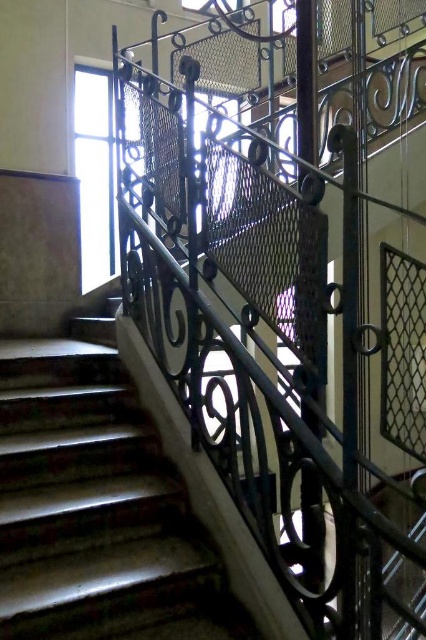
Between point (236, 241) and point (143, 486), which one is positioned behind?

Positioned behind is point (143, 486).

What do you see at coordinates (279, 298) in the screenshot?
I see `black wrought iron at upper center` at bounding box center [279, 298].

What do you see at coordinates (279, 298) in the screenshot?
I see `black wrought iron at upper center` at bounding box center [279, 298].

At what (x,y) coordinates should I click in order to perform the action: click on black wrought iron at upper center. Please return your answer as a coordinate pair (x, y). Looking at the image, I should click on (279, 298).